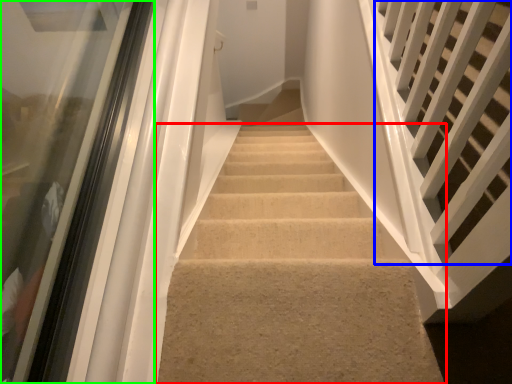
Question: Estimate the real-world distances between objects in this image. Which object is farther from stairs (highlighted by a red box), stairs (highlighted by a blue box) or glass door (highlighted by a green box)?

Choices:
 (A) stairs
 (B) glass door

Answer: (B)